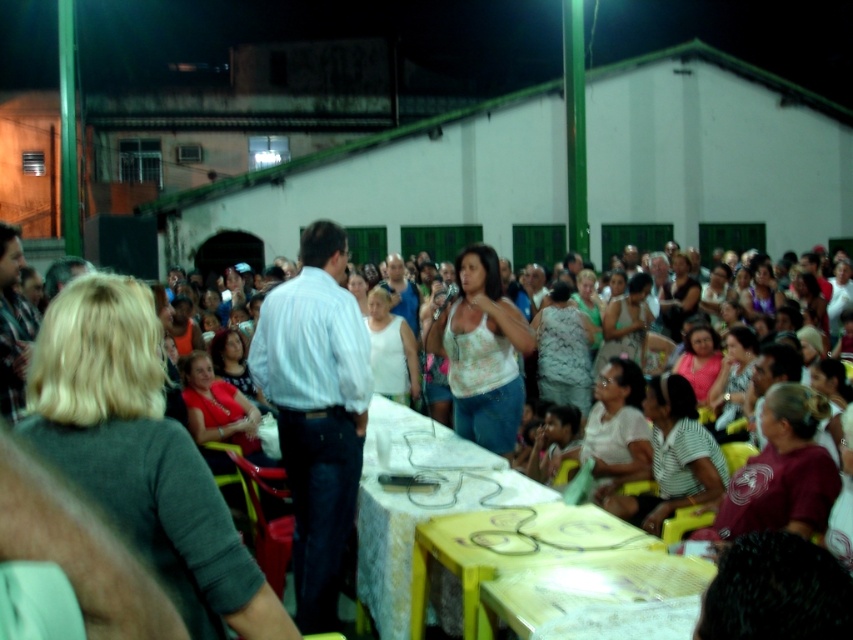
You are standing at the back of the crowd in the town square and want to take a photo of both the point at coordinates point (292,362) and point (502,576). Which point should you focus on first to ensure both are in focus?

You should focus on point (292,362) first because it is closer to you than point (502,576), so adjusting the focus from near to far will help both points be in focus.

You are standing at point A, which is at coordinates point A at (x=383, y=516). You want to walk to point B, which is 7.91 meters away. Is this distance within a comfortable walking distance for a casual stroll?

The distance between point A at (x=383, y=516) and point B is 7.91 meters, which is a comfortable walking distance for a casual stroll.

You are attending a night event in the town square and notice two objects of interest. You see the white shirt at center and the wooden table at lower center. Which object appears bigger in the image?

The white shirt at center appears larger in size than the wooden table at lower center according to the description.